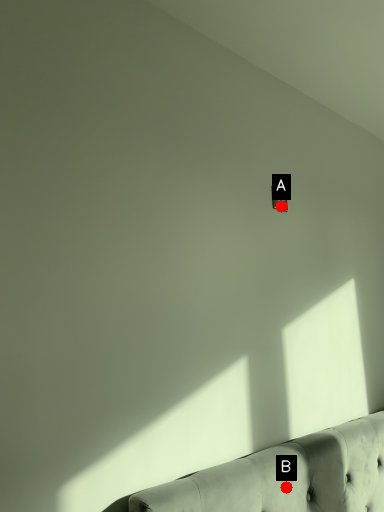
Question: Two points are circled on the image, labeled by A and B beside each circle. Which point appears farthest from the camera in this image?

Choices:
 (A) A is further
 (B) B is further

Answer: (A)